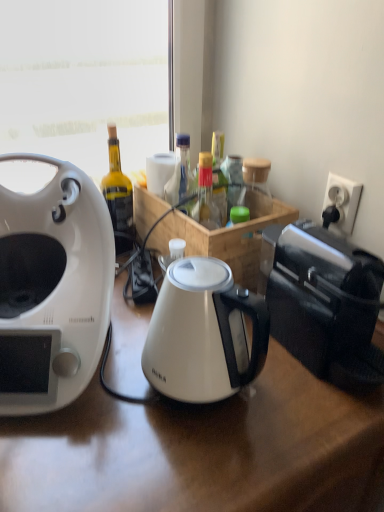
This screenshot has height=512, width=384. What do you see at coordinates (52, 289) in the screenshot?
I see `white glossy coffee maker at left` at bounding box center [52, 289].

The height and width of the screenshot is (512, 384). What do you see at coordinates (341, 203) in the screenshot? I see `white plastic power outlet at upper right` at bounding box center [341, 203].

Find the location of a particular element. Image resolution: width=384 pixels, height=512 pixels. white plastic power outlet at upper right is located at coordinates (341, 203).

What is the approximate width of black plastic toaster at right?

black plastic toaster at right is 13.52 inches in width.

Locate an element on the screen. Image resolution: width=384 pixels, height=512 pixels. white glossy coffee maker at left is located at coordinates 52,289.

Consider the image. From the image's perspective, who appears lower, translucent glass bottle at center or white glossy coffee maker at left?

white glossy coffee maker at left appears lower in the image.

Consider the image. Does translucent glass bottle at center have a lesser height compared to white glossy coffee maker at left?

Yes.

Considering the positions of objects translucent glass bottle at center and white glossy coffee maker at left in the image provided, who is in front, translucent glass bottle at center or white glossy coffee maker at left?

Positioned in front is white glossy coffee maker at left.

Based on the photo, is white glossy coffee maker at left positioned beyond the bounds of black plastic toaster at right?

white glossy coffee maker at left is positioned outside black plastic toaster at right.

Looking at their sizes, would you say white glossy coffee maker at left is wider or thinner than black plastic toaster at right?

white glossy coffee maker at left is thinner than black plastic toaster at right.

Are white glossy coffee maker at left and black plastic toaster at right far apart?

No, white glossy coffee maker at left is not far away from black plastic toaster at right.

Would you say white plastic power outlet at upper right is part of white glossy coffee maker at left's contents?

Actually, white plastic power outlet at upper right is outside white glossy coffee maker at left.

Between white glossy coffee maker at left and white plastic power outlet at upper right, which one has smaller size?

white plastic power outlet at upper right.

Measure the distance between white glossy coffee maker at left and white plastic power outlet at upper right.

They are 21.95 inches apart.

Based on the photo, could you tell me if white glossy coffee maker at left is facing white plastic power outlet at upper right?

No, white glossy coffee maker at left is not oriented towards white plastic power outlet at upper right.

Is white glossy electric kettle at center wider than translucent glass bottle at center?

Yes, white glossy electric kettle at center is wider than translucent glass bottle at center.

Who is shorter, white glossy electric kettle at center or translucent glass bottle at center?

With less height is translucent glass bottle at center.

Can you tell me how much white glossy electric kettle at center and translucent glass bottle at center differ in facing direction?

The angle between the facing direction of white glossy electric kettle at center and the facing direction of translucent glass bottle at center is 0.215 degrees.

Considering the sizes of white glossy electric kettle at center and translucent glass bottle at center in the image, is white glossy electric kettle at center bigger or smaller than translucent glass bottle at center?

In the image, white glossy electric kettle at center appears to be larger than translucent glass bottle at center.

Find the location of `coffee maker located below the translucent glass bottle at center (from the image's perspective)`. coffee maker located below the translucent glass bottle at center (from the image's perspective) is located at coordinates (52, 289).

Between white glossy coffee maker at left and translucent glass bottle at center, which one is positioned in front?

white glossy coffee maker at left.

Considering the sizes of white glossy coffee maker at left and translucent glass bottle at center in the image, is white glossy coffee maker at left taller or shorter than translucent glass bottle at center?

In the image, white glossy coffee maker at left appears to be taller than translucent glass bottle at center.

Is the surface of translucent glass bottle at center in direct contact with white plastic power outlet at upper right?

No, translucent glass bottle at center is not touching white plastic power outlet at upper right.

Is translucent glass bottle at center to the right of white plastic power outlet at upper right from the viewer's perspective?

Incorrect, translucent glass bottle at center is not on the right side of white plastic power outlet at upper right.

In terms of height, does translucent glass bottle at center look taller or shorter compared to white plastic power outlet at upper right?

Considering their sizes, translucent glass bottle at center has more height than white plastic power outlet at upper right.

Which object is thinner, black plastic toaster at right or white glossy coffee maker at left?

white glossy coffee maker at left is thinner.

How distant is black plastic toaster at right from white glossy coffee maker at left?

A distance of 15.44 inches exists between black plastic toaster at right and white glossy coffee maker at left.

From the picture: From the image's perspective, is black plastic toaster at right beneath white glossy coffee maker at left?

Yes, from the image's perspective, black plastic toaster at right is beneath white glossy coffee maker at left.

Considering the relative sizes of black plastic toaster at right and white glossy coffee maker at left in the image provided, is black plastic toaster at right taller than white glossy coffee maker at left?

No.

There is a white glossy coffee maker at left. Where is `bottle above it (from a real-world perspective)`? This screenshot has height=512, width=384. bottle above it (from a real-world perspective) is located at coordinates (206, 195).

Locate an element on the screen. The image size is (384, 512). toaster below the white glossy coffee maker at left (from a real-world perspective) is located at coordinates (326, 304).

Based on the photo, considering their positions, is white plastic power outlet at upper right positioned closer to white glossy electric kettle at center than black plastic toaster at right?

black plastic toaster at right lies closer to white glossy electric kettle at center than the other object.

Which object lies further to the anchor point white plastic power outlet at upper right, translucent glass bottle at center or white glossy coffee maker at left?

white glossy coffee maker at left lies further to white plastic power outlet at upper right than the other object.

When comparing their distances from white glossy coffee maker at left, does black plastic toaster at right or white glossy electric kettle at center seem further?

The object further to white glossy coffee maker at left is black plastic toaster at right.

Estimate the real-world distances between objects in this image. Which object is further from white plastic power outlet at upper right, white glossy electric kettle at center or black plastic toaster at right?

white glossy electric kettle at center.

Based on their spatial positions, is black plastic toaster at right or white glossy electric kettle at center further from white plastic power outlet at upper right?

Among the two, white glossy electric kettle at center is located further to white plastic power outlet at upper right.

From the picture: Estimate the real-world distances between objects in this image. Which object is closer to white glossy electric kettle at center, white plastic power outlet at upper right or translucent glass bottle at center?

translucent glass bottle at center lies closer to white glossy electric kettle at center than the other object.

Estimate the real-world distances between objects in this image. Which object is closer to black plastic toaster at right, translucent glass bottle at center or white glossy coffee maker at left?

translucent glass bottle at center is positioned closer to the anchor black plastic toaster at right.

From the image, which object appears to be nearer to translucent glass bottle at center, white glossy electric kettle at center or white plastic power outlet at upper right?

white plastic power outlet at upper right is closer to translucent glass bottle at center.

The width and height of the screenshot is (384, 512). What are the coordinates of `toaster located between white glossy electric kettle at center and translucent glass bottle at center in the depth direction` in the screenshot? It's located at (326, 304).

The height and width of the screenshot is (512, 384). Find the location of `power outlet positioned between white glossy electric kettle at center and translucent glass bottle at center from near to far`. power outlet positioned between white glossy electric kettle at center and translucent glass bottle at center from near to far is located at coordinates coord(341,203).

The height and width of the screenshot is (512, 384). In order to click on bottle situated between white glossy coffee maker at left and black plastic toaster at right from left to right in this screenshot , I will do `click(206, 195)`.

Identify the location of bottle situated between white glossy coffee maker at left and white plastic power outlet at upper right from left to right. The height and width of the screenshot is (512, 384). (206, 195).